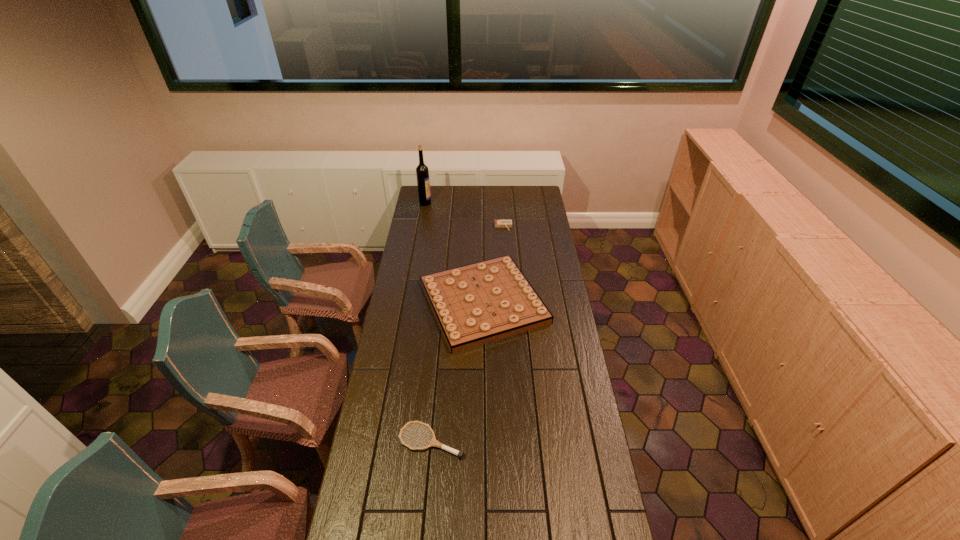
Image resolution: width=960 pixels, height=540 pixels. In order to click on the leftmost object in this screenshot , I will do `click(422, 172)`.

Image resolution: width=960 pixels, height=540 pixels. In order to click on the farthest object in this screenshot , I will do `click(422, 172)`.

Locate an element on the screen. Image resolution: width=960 pixels, height=540 pixels. gameboard is located at coordinates (475, 304).

Find the location of `the third farthest object`. the third farthest object is located at coordinates (475, 304).

The width and height of the screenshot is (960, 540). I want to click on the third nearest object, so click(x=498, y=223).

This screenshot has width=960, height=540. In order to click on the nearest object in this screenshot , I will do `click(433, 442)`.

Find the location of a particular element. The image size is (960, 540). free point located 0.250m on the label of the farthest object is located at coordinates (470, 203).

What are the coordinates of `blank area located 0.120m on the back of the third farthest object` in the screenshot? It's located at (483, 248).

You are a GUI agent. You are given a task and a screenshot of the screen. Output one action in this format:
    pyautogui.click(x=<x>, y=<y>)
    Task: Click on the free region located on the striking surface of the matchbox
    
    Given the screenshot: What is the action you would take?
    pyautogui.click(x=507, y=273)

Find the location of a particular element. The height and width of the screenshot is (540, 960). vacant space situated 0.070m on the right of the nearest object is located at coordinates (484, 441).